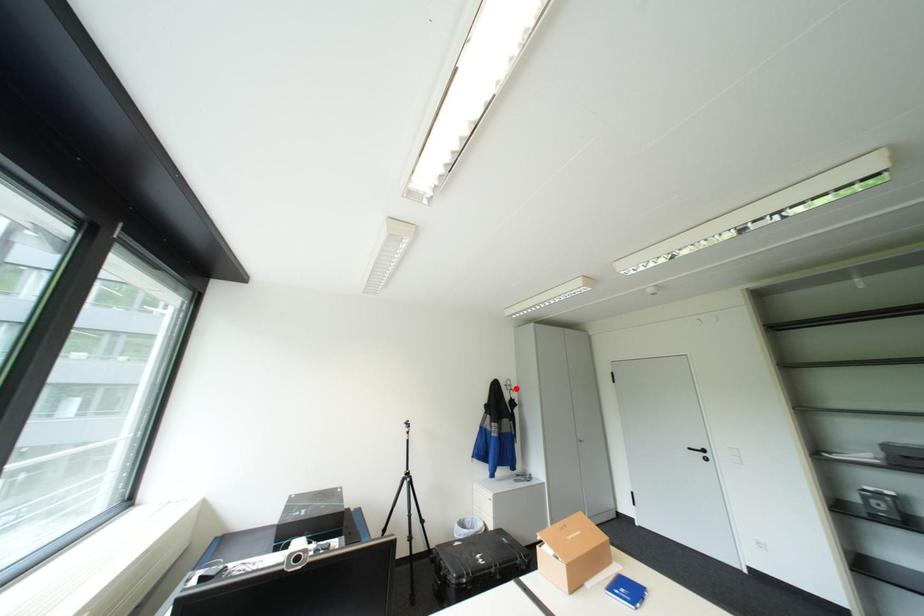
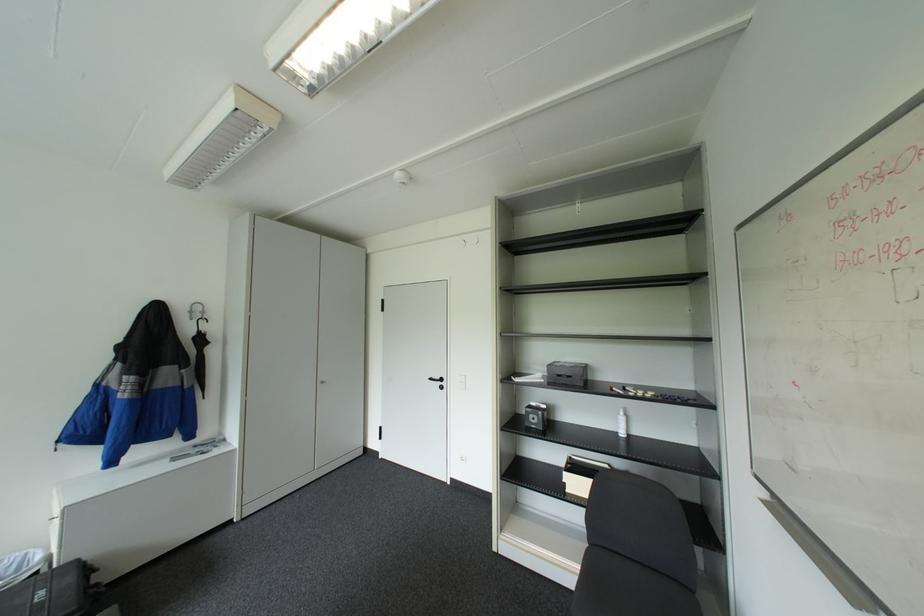
Locate, in the second image, the point that corresponds to the highlighted location in the first image.

(200, 318)